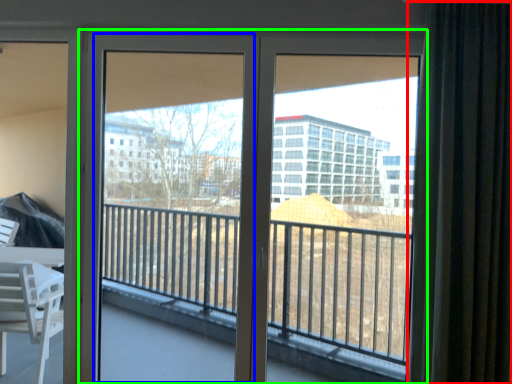
Question: Which object is positioned closest to curtain (highlighted by a red box)? Select from screen door (highlighted by a blue box) and door (highlighted by a green box).

Choices:
 (A) screen door
 (B) door

Answer: (B)